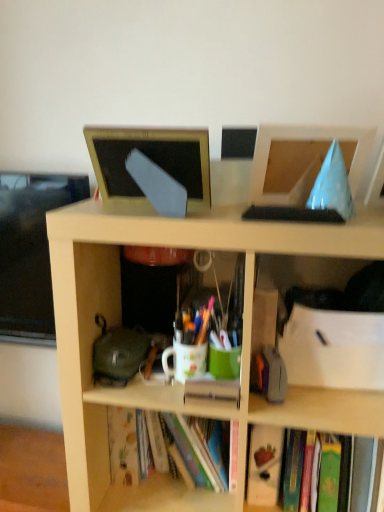
Question: Is hardcover book at lower right to the left of matte gold frame at upper center, arranged as the 1th computer monitor when viewed from the left, from the viewer's perspective?

Choices:
 (A) no
 (B) yes

Answer: (A)

Question: Is hardcover book at lower right positioned far away from matte gold frame at upper center, the 2th computer monitor viewed from the right?

Choices:
 (A) no
 (B) yes

Answer: (A)

Question: Would you say hardcover book at lower right is outside matte gold frame at upper center, the 2th computer monitor viewed from the right?

Choices:
 (A) no
 (B) yes

Answer: (B)

Question: From the image's perspective, is hardcover book at lower right beneath matte gold frame at upper center, arranged as the 1th computer monitor when viewed from the left?

Choices:
 (A) yes
 (B) no

Answer: (A)

Question: Is hardcover book at lower right surrounding matte gold frame at upper center, arranged as the 1th computer monitor when viewed from the left?

Choices:
 (A) no
 (B) yes

Answer: (A)

Question: Is blue paper cone at upper right, marked as the 1th computer monitor in a right-to-left arrangement, to the left or to the right of translucent plastic pen at center in the image?

Choices:
 (A) left
 (B) right

Answer: (B)

Question: In terms of width, does blue paper cone at upper right, the 2th computer monitor in the left-to-right sequence, look wider or thinner when compared to translucent plastic pen at center?

Choices:
 (A) thin
 (B) wide

Answer: (B)

Question: Is blue paper cone at upper right, marked as the 1th computer monitor in a right-to-left arrangement, spatially inside translucent plastic pen at center, or outside of it?

Choices:
 (A) outside
 (B) inside

Answer: (A)

Question: Relative to translucent plastic pen at center, is blue paper cone at upper right, marked as the 1th computer monitor in a right-to-left arrangement, in front or behind?

Choices:
 (A) front
 (B) behind

Answer: (A)

Question: From the image's perspective, is matte gold frame at upper center, the 2th computer monitor viewed from the right, above or below blue paper cone at upper right, marked as the 1th computer monitor in a right-to-left arrangement?

Choices:
 (A) below
 (B) above

Answer: (B)

Question: Is matte gold frame at upper center, arranged as the 1th computer monitor when viewed from the left, inside the boundaries of blue paper cone at upper right, the 2th computer monitor in the left-to-right sequence, or outside?

Choices:
 (A) inside
 (B) outside

Answer: (B)

Question: From a real-world perspective, is matte gold frame at upper center, the 2th computer monitor viewed from the right, positioned above or below blue paper cone at upper right, the 2th computer monitor in the left-to-right sequence?

Choices:
 (A) below
 (B) above

Answer: (B)

Question: Looking at the image, does matte gold frame at upper center, the 2th computer monitor viewed from the right, seem bigger or smaller compared to blue paper cone at upper right, marked as the 1th computer monitor in a right-to-left arrangement?

Choices:
 (A) small
 (B) big

Answer: (B)

Question: Looking at the image, does translucent plastic pen at center seem bigger or smaller compared to hardcover book at lower right?

Choices:
 (A) small
 (B) big

Answer: (A)

Question: Considering the positions of translucent plastic pen at center and hardcover book at lower right in the image, is translucent plastic pen at center taller or shorter than hardcover book at lower right?

Choices:
 (A) tall
 (B) short

Answer: (B)